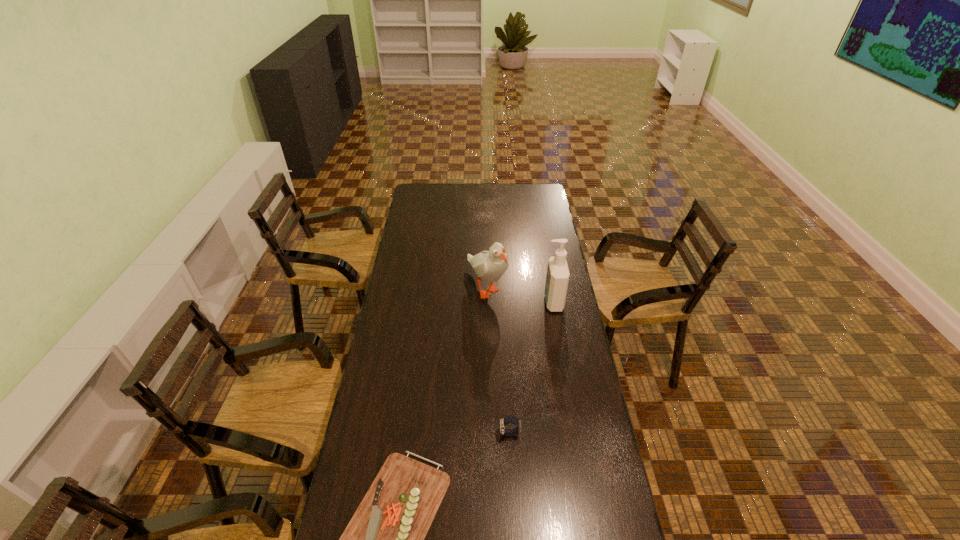
This screenshot has width=960, height=540. Identify the location of the rightmost object. (557, 278).

The image size is (960, 540). Find the location of `gull`. gull is located at coordinates (490, 265).

Where is `the third farthest object`? This screenshot has height=540, width=960. the third farthest object is located at coordinates (509, 419).

Where is `watch`? The width and height of the screenshot is (960, 540). watch is located at coordinates (509, 419).

Find the location of `vacant region located on the front label of the rightmost object`. vacant region located on the front label of the rightmost object is located at coordinates (520, 302).

Find the location of a particular element. The height and width of the screenshot is (540, 960). vacant space situated 0.240m on the front label of the rightmost object is located at coordinates (489, 302).

I want to click on free space located 0.270m on the front label of the rightmost object, so click(x=482, y=302).

This screenshot has width=960, height=540. What are the coordinates of `free spot located at the beak of the gull` in the screenshot? It's located at (488, 372).

The image size is (960, 540). I want to click on vacant area situated 0.190m on the face of the second nearest object, so click(443, 434).

You are a GUI agent. You are given a task and a screenshot of the screen. Output one action in this format:
    pyautogui.click(x=<x>, y=<y>)
    Task: Click on the free space located on the face of the second nearest object
    The image size is (960, 540).
    Given the screenshot: What is the action you would take?
    pyautogui.click(x=410, y=434)